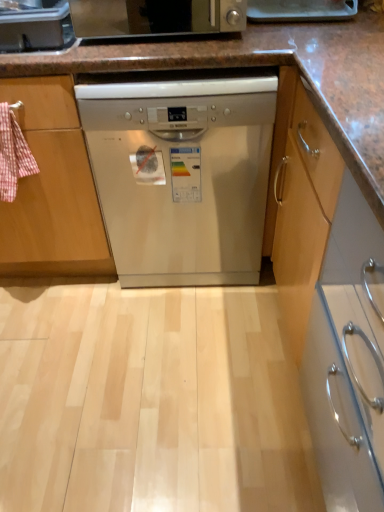
Question: Is satin silver toaster at upper center bigger or smaller than satin silver dishwasher at center?

Choices:
 (A) small
 (B) big

Answer: (A)

Question: Considering their positions, is satin silver toaster at upper center located in front of or behind satin silver dishwasher at center?

Choices:
 (A) front
 (B) behind

Answer: (A)

Question: Based on their relative distances, which object is nearer to the satin silver dishwasher at center?

Choices:
 (A) satin silver toaster at upper center
 (B) satin silver toaster at upper left

Answer: (A)

Question: Which object is positioned closest to the satin silver dishwasher at center?

Choices:
 (A) satin silver toaster at upper left
 (B) satin silver toaster at upper center

Answer: (B)